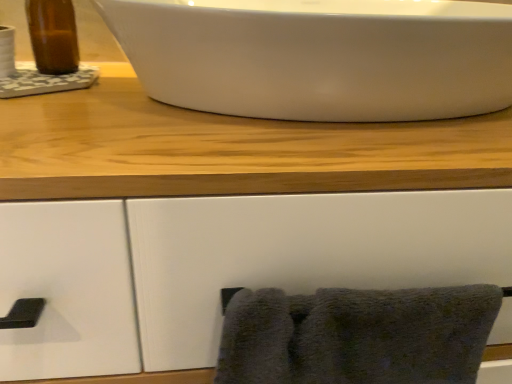
Question: Is point (106, 1) closer or farther from the camera than point (269, 307)?

Choices:
 (A) closer
 (B) farther

Answer: (B)

Question: Relative to dark gray fluffy towel at lower right, is white glossy sink at upper center, acting as the 2th sink starting from the left, in front or behind?

Choices:
 (A) behind
 (B) front

Answer: (B)

Question: Considering the real-world distances, which object is farthest from the white glossy sink at upper center, the 1th sink when ordered from right to left?

Choices:
 (A) brown glass bottle at upper left, the 1th sink when ordered from left to right
 (B) dark gray fluffy towel at lower right

Answer: (A)

Question: Considering the real-world distances, which object is farthest from the brown glass bottle at upper left, the 1th sink when ordered from left to right?

Choices:
 (A) white glossy sink at upper center, the 1th sink when ordered from right to left
 (B) dark gray fluffy towel at lower right

Answer: (B)